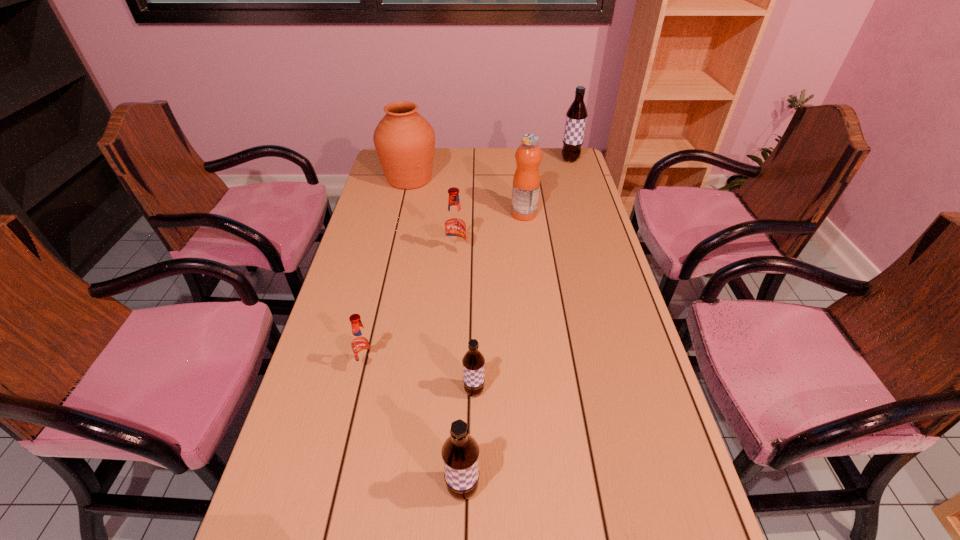
The height and width of the screenshot is (540, 960). Find the location of `the third closest root beer to the sixth nearest object`. the third closest root beer to the sixth nearest object is located at coordinates (362, 345).

Locate which root beer ranks fourth in proximity to the brown urn. Please provide its 2D coordinates. Your answer should be formatted as a tuple, i.e. [(x, y)], where the tuple contains the x and y coordinates of a point satisfying the conditions above.

[(473, 361)]

This screenshot has height=540, width=960. I want to click on brown root beer identified as the closest to the farthest root beer, so click(x=473, y=361).

Locate which brown root beer is the third closest to the brown urn. Please provide its 2D coordinates. Your answer should be formatted as a tuple, i.e. [(x, y)], where the tuple contains the x and y coordinates of a point satisfying the conditions above.

[(460, 452)]

At what (x,y) coordinates should I click in order to perform the action: click on blank space that satisfies the following two spatial constraints: 1. on the back side of the third farthest object; 2. on the right side of the smallest brown root beer. Please return your answer as a coordinate pair (x, y). This screenshot has height=540, width=960. Looking at the image, I should click on (476, 214).